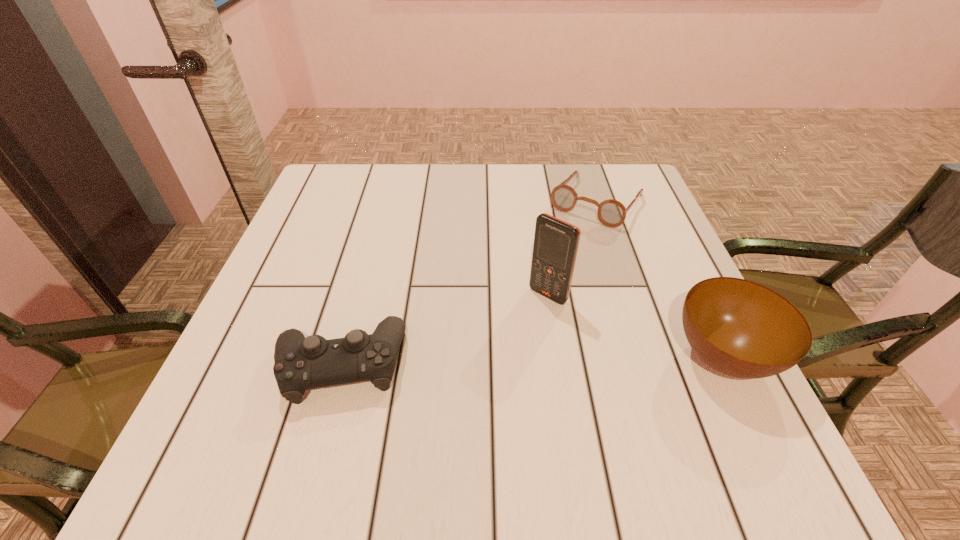
Identify the location of free space located 0.180m on the front-facing side of the shortest object. Image resolution: width=960 pixels, height=540 pixels. (545, 271).

What are the coordinates of `free spot located on the front-facing side of the shortest object` in the screenshot? It's located at (536, 284).

What are the coordinates of `free point located on the screen of the cellular telephone` in the screenshot? It's located at (506, 339).

In order to click on vacant space situated 0.200m on the screen of the cellular telephone in this screenshot , I will do `click(475, 370)`.

You are a GUI agent. You are given a task and a screenshot of the screen. Output one action in this format:
    pyautogui.click(x=<x>, y=<y>)
    Task: Click on the vacant space located 0.150m on the screen of the cellular telephone
    The image size is (960, 540).
    Given the screenshot: What is the action you would take?
    pyautogui.click(x=492, y=353)

Identify the location of object located at the far edge. (611, 213).

Locate an element on the screen. control positioned at the near edge is located at coordinates (301, 363).

The image size is (960, 540). I want to click on bowl located at the near edge, so click(x=740, y=328).

You are a GUI agent. You are given a task and a screenshot of the screen. Output one action in this format:
    pyautogui.click(x=<x>, y=<y>)
    Task: Click on the object present at the left edge
    
    Given the screenshot: What is the action you would take?
    pyautogui.click(x=301, y=363)

Where is `bowl at the right edge`? This screenshot has width=960, height=540. bowl at the right edge is located at coordinates (740, 328).